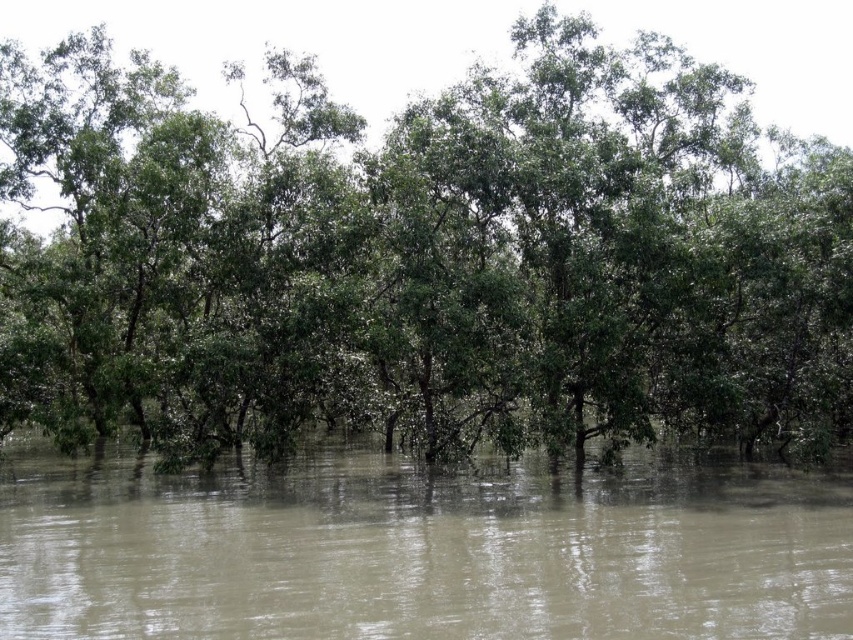
Can you confirm if green leafy trees at center is wider than brown muddy water at center?

Yes.

Who is higher up, green leafy trees at center or brown muddy water at center?

green leafy trees at center is above.

This screenshot has height=640, width=853. Describe the element at coordinates (421, 257) in the screenshot. I see `green leafy trees at center` at that location.

I want to click on green leafy trees at center, so click(421, 257).